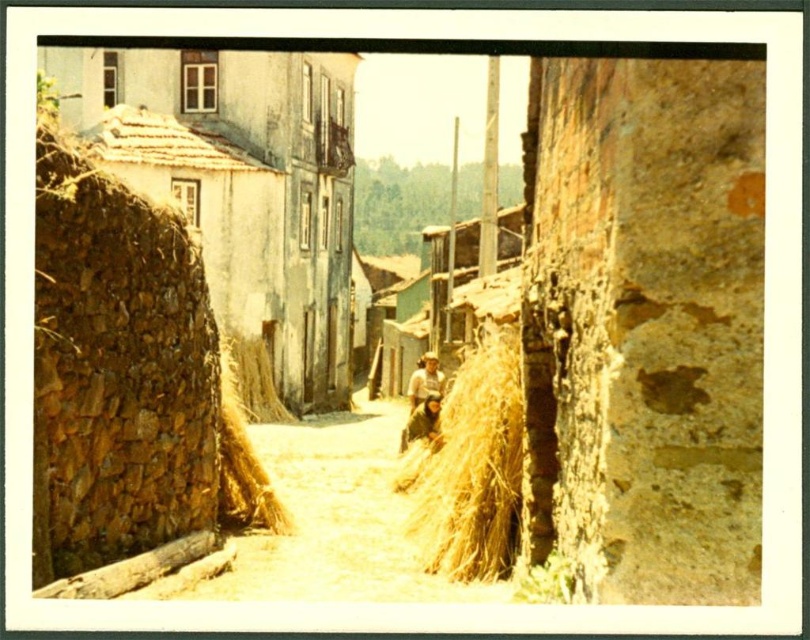
You are standing at the entrance of the alleyway and want to find the stone textured hut at left. According to the coordinates given, where should you look relative to your position?

The stone textured hut at left is located at coordinates point (241, 184), which means it is positioned approximately 29 percent from the left and 30 percent from the bottom of the scene. Since you are at the entrance, you should look towards the left side of the alleyway, slightly upwards from the bottom to locate it.

You are a delivery person trying to navigate through the narrow alleyway. You see two bundles of straw, the yellow straw at center and the brown straw at center. Which bundle of straw is narrower in width?

The yellow straw at center has a lesser width compared to the brown straw at center, so the yellow straw at center is narrower.

You are standing in the middle of the alleyway and see two points marked on the ground. The first point is at coordinate point (510, 476) and the second is at point (263, 344). If you want to walk towards the point that is closer to the entrance of the alley, which coordinate should you head towards?

Point (263, 344) is closer to the entrance of the alley because it is behind point (510, 476), meaning it is nearer to the starting point of the alleyway.